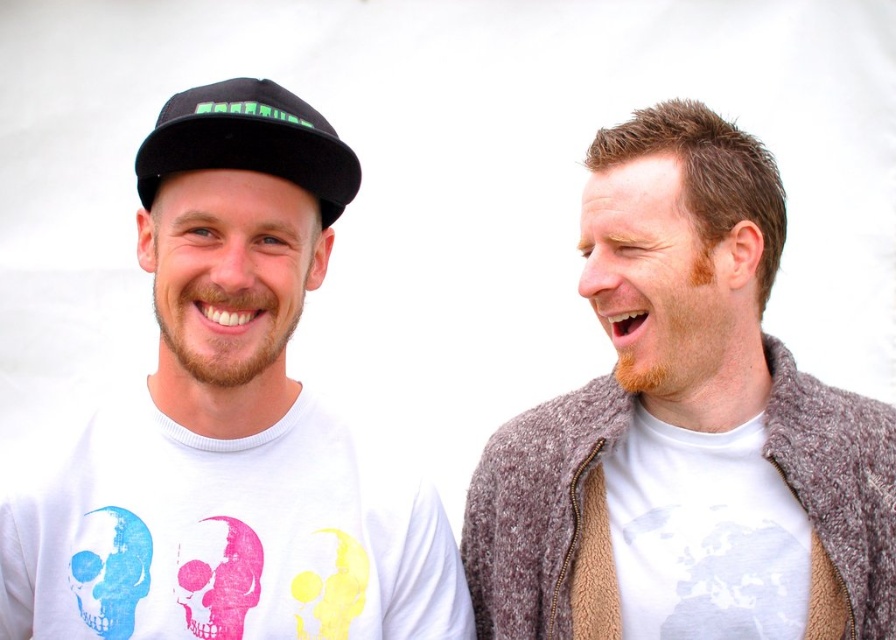
Question: Among these points, which one is farthest from the camera?

Choices:
 (A) (197, 548)
 (B) (337, 150)
 (C) (101, 637)
 (D) (274, 374)

Answer: (D)

Question: Which is nearer to the white cotton t-shirt at center?

Choices:
 (A) pink matte skull at left
 (B) black matte cap at upper left
 (C) blue matte skull at left

Answer: (B)

Question: Does white matte t-shirt at left have a larger size compared to blue matte skull at left?

Choices:
 (A) no
 (B) yes

Answer: (B)

Question: Considering the relative positions of white matte t-shirt at left and black matte cap at upper left in the image provided, where is white matte t-shirt at left located with respect to black matte cap at upper left?

Choices:
 (A) above
 (B) below

Answer: (B)

Question: Which of these objects is positioned closest to the blue matte skull at left?

Choices:
 (A) white cotton t-shirt at center
 (B) pink matte skull at left
 (C) black matte cap at upper left

Answer: (B)

Question: In this image, where is pink matte skull at left located relative to blue matte skull at left?

Choices:
 (A) right
 (B) left

Answer: (A)